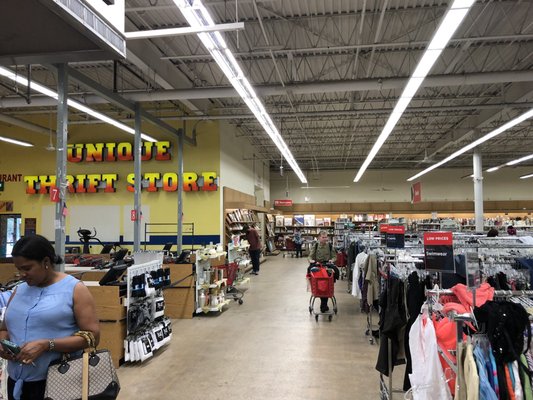
You are a GUI agent. You are given a task and a screenshot of the screen. Output one action in this format:
    pyautogui.click(x=<x>, y=<y>)
    Task: Click on the white rectangle on yellow wall
    This screenshot has width=533, height=400.
    Given the screenshot: What is the action you would take?
    pyautogui.click(x=84, y=222), pyautogui.click(x=131, y=227)